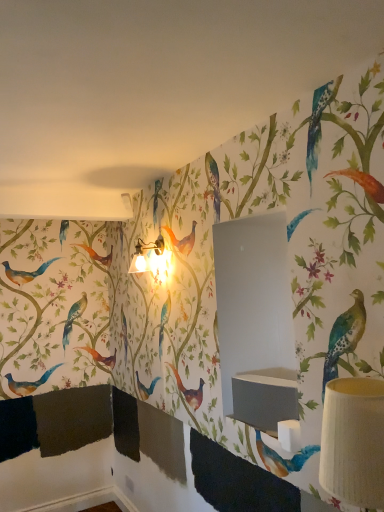
What do you see at coordinates (265, 398) in the screenshot? The width and height of the screenshot is (384, 512). I see `matte gray sink at center` at bounding box center [265, 398].

Where is `metallic gold table lamp at upper center, the 2th table lamp in the right-to-left sequence`? The image size is (384, 512). metallic gold table lamp at upper center, the 2th table lamp in the right-to-left sequence is located at coordinates (152, 259).

Is matte gray sink at center at the right side of metallic gold table lamp at upper center, acting as the first table lamp starting from the back?

Correct, you'll find matte gray sink at center to the right of metallic gold table lamp at upper center, acting as the first table lamp starting from the back.

Is matte gray sink at center not within metallic gold table lamp at upper center, the 2th table lamp in the right-to-left sequence?

That's correct, matte gray sink at center is outside of metallic gold table lamp at upper center, the 2th table lamp in the right-to-left sequence.

Which of these two, matte gray sink at center or metallic gold table lamp at upper center, acting as the first table lamp starting from the back, is thinner?

matte gray sink at center is thinner.

Is matte gray sink at center oriented away from metallic gold table lamp at upper center, the 2th table lamp in the right-to-left sequence?

No, matte gray sink at center is not facing away from metallic gold table lamp at upper center, the 2th table lamp in the right-to-left sequence.

From the image's perspective, which is below, metallic gold table lamp at upper center, the 2th table lamp in the front-to-back sequence, or matte gray sink at center?

From the image's view, matte gray sink at center is below.

Is metallic gold table lamp at upper center, which appears as the second table lamp when ordered from the bottom, looking in the opposite direction of matte gray sink at center?

No, metallic gold table lamp at upper center, which appears as the second table lamp when ordered from the bottom, is not facing away from matte gray sink at center.

Is metallic gold table lamp at upper center, acting as the first table lamp starting from the back, next to matte gray sink at center and touching it?

No.

Does metallic gold table lamp at upper center, acting as the first table lamp starting from the back, have a greater width compared to matte gray sink at center?

Indeed, metallic gold table lamp at upper center, acting as the first table lamp starting from the back, has a greater width compared to matte gray sink at center.

Looking at this image, from a real-world perspective, which is physically above, metallic gold table lamp at upper center, the 2th table lamp in the right-to-left sequence, or white textured lampshade at right, acting as the 2th table lamp starting from the back?

metallic gold table lamp at upper center, the 2th table lamp in the right-to-left sequence, is physically above.

Which point is more forward, (166, 275) or (343, 471)?

Positioned in front is point (343, 471).

Locate an element on the screen. table lamp positioned vertically above the white textured lampshade at right, the 1th table lamp viewed from the right (from a real-world perspective) is located at coordinates (152, 259).

Is white textured lampshade at right, which is the 2th table lamp from left to right, completely or partially outside of metallic gold table lamp at upper center, which is the 1th table lamp in top-to-bottom order?

white textured lampshade at right, which is the 2th table lamp from left to right, is positioned outside metallic gold table lamp at upper center, which is the 1th table lamp in top-to-bottom order.

You are a GUI agent. You are given a task and a screenshot of the screen. Output one action in this format:
    pyautogui.click(x=<x>, y=<y>)
    Task: Click on the table lamp that is above the white textured lampshade at right, which is the 2th table lamp from left to right (from a real-world perspective)
    
    Given the screenshot: What is the action you would take?
    pyautogui.click(x=152, y=259)

Is white textured lampshade at right, acting as the 2th table lamp starting from the back, far from metallic gold table lamp at upper center, which is the first table lamp in left-to-right order?

Answer: Yes.

Can you tell me how much white textured lampshade at right, the second table lamp in the top-to-bottom sequence, and metallic gold table lamp at upper center, which is the 1th table lamp in top-to-bottom order, differ in facing direction?

The angle between the facing direction of white textured lampshade at right, the second table lamp in the top-to-bottom sequence, and the facing direction of metallic gold table lamp at upper center, which is the 1th table lamp in top-to-bottom order, is 5.77 degrees.

From the image's perspective, does white textured lampshade at right, the 1th table lamp when ordered from front to back, appear lower than matte gray sink at center?

No, from the image's perspective, white textured lampshade at right, the 1th table lamp when ordered from front to back, is not beneath matte gray sink at center.

From a real-world perspective, which is physically below, white textured lampshade at right, which is the 2th table lamp from left to right, or matte gray sink at center?

In real-world perspective, matte gray sink at center is lower.

Considering the relative positions of white textured lampshade at right, the 1th table lamp viewed from the right, and matte gray sink at center in the image provided, is white textured lampshade at right, the 1th table lamp viewed from the right, to the left of matte gray sink at center from the viewer's perspective?

No, white textured lampshade at right, the 1th table lamp viewed from the right, is not to the left of matte gray sink at center.

Is point (348, 489) closer or farther from the camera than point (291, 384)?

Point (348, 489) is positioned closer to the camera compared to point (291, 384).

Could you measure the distance between matte gray sink at center and white textured lampshade at right, the 1th table lamp when ordered from front to back?

matte gray sink at center is 30.26 inches from white textured lampshade at right, the 1th table lamp when ordered from front to back.

Which of these two, matte gray sink at center or white textured lampshade at right, which ranks as the first table lamp in bottom-to-top order, stands taller?

white textured lampshade at right, which ranks as the first table lamp in bottom-to-top order.

Between matte gray sink at center and white textured lampshade at right, the 1th table lamp viewed from the right, which one has smaller width?

Thinner between the two is matte gray sink at center.

Based on the photo, could white textured lampshade at right, acting as the 2th table lamp starting from the back, be considered to be inside matte gray sink at center?

No, white textured lampshade at right, acting as the 2th table lamp starting from the back, is not inside matte gray sink at center.

I want to click on table lamp that is the 2nd object above the matte gray sink at center (from a real-world perspective), so click(152, 259).

Where is `sink on the right of metallic gold table lamp at upper center, the 2th table lamp in the front-to-back sequence`? The height and width of the screenshot is (512, 384). sink on the right of metallic gold table lamp at upper center, the 2th table lamp in the front-to-back sequence is located at coordinates (265, 398).

Consider the image. Estimate the real-world distances between objects in this image. Which object is closer to metallic gold table lamp at upper center, acting as the first table lamp starting from the back, matte gray sink at center or white textured lampshade at right, which ranks as the first table lamp in bottom-to-top order?

matte gray sink at center.

In the scene shown: Estimate the real-world distances between objects in this image. Which object is closer to matte gray sink at center, metallic gold table lamp at upper center, which is the 1th table lamp in top-to-bottom order, or white textured lampshade at right, acting as the 2th table lamp starting from the back?

white textured lampshade at right, acting as the 2th table lamp starting from the back, is positioned closer to the anchor matte gray sink at center.

From the image, which object appears to be farther from white textured lampshade at right, the 1th table lamp viewed from the right, matte gray sink at center or metallic gold table lamp at upper center, which is the 1th table lamp in top-to-bottom order?

metallic gold table lamp at upper center, which is the 1th table lamp in top-to-bottom order, is positioned further to the anchor white textured lampshade at right, the 1th table lamp viewed from the right.

From the image, which object appears to be nearer to matte gray sink at center, white textured lampshade at right, which ranks as the first table lamp in bottom-to-top order, or metallic gold table lamp at upper center, the 2th table lamp in the right-to-left sequence?

Among the two, white textured lampshade at right, which ranks as the first table lamp in bottom-to-top order, is located nearer to matte gray sink at center.

Looking at the image, which one is located further to white textured lampshade at right, the 1th table lamp when ordered from front to back, metallic gold table lamp at upper center, which is the first table lamp in left-to-right order, or matte gray sink at center?

Based on the image, metallic gold table lamp at upper center, which is the first table lamp in left-to-right order, appears to be further to white textured lampshade at right, the 1th table lamp when ordered from front to back.

Estimate the real-world distances between objects in this image. Which object is further from metallic gold table lamp at upper center, the 2th table lamp in the front-to-back sequence, white textured lampshade at right, the second table lamp in the top-to-bottom sequence, or matte gray sink at center?

Among the two, white textured lampshade at right, the second table lamp in the top-to-bottom sequence, is located further to metallic gold table lamp at upper center, the 2th table lamp in the front-to-back sequence.

The width and height of the screenshot is (384, 512). Identify the location of sink between white textured lampshade at right, which ranks as the first table lamp in bottom-to-top order, and metallic gold table lamp at upper center, which is the first table lamp in left-to-right order, along the z-axis. (265, 398).